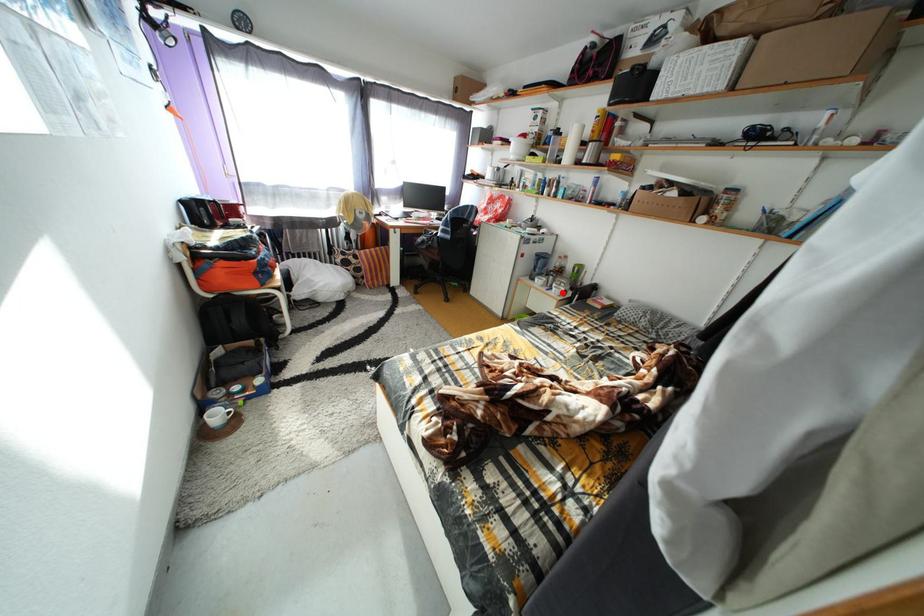
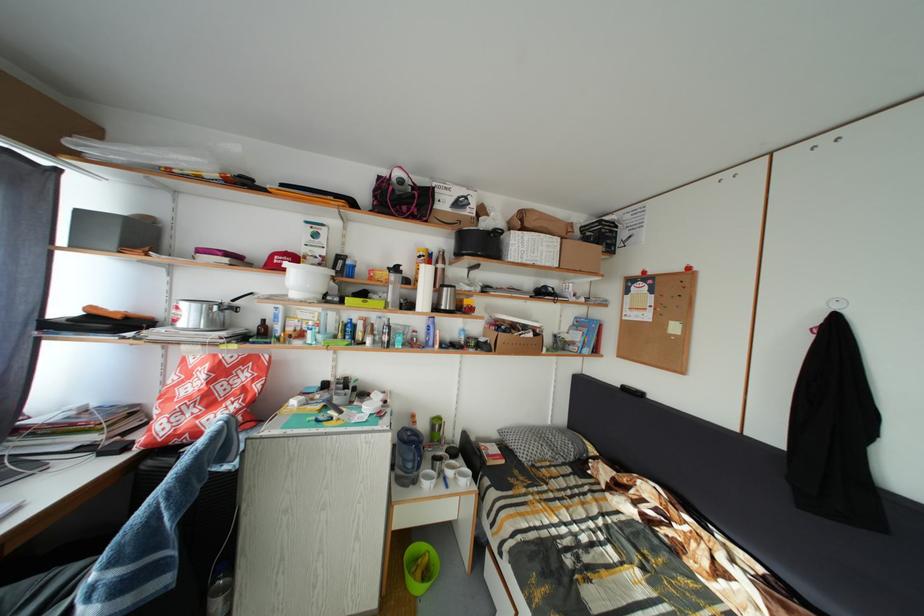
Where in the second image is the point corresponding to the highlighted location from the first image?

(458, 480)